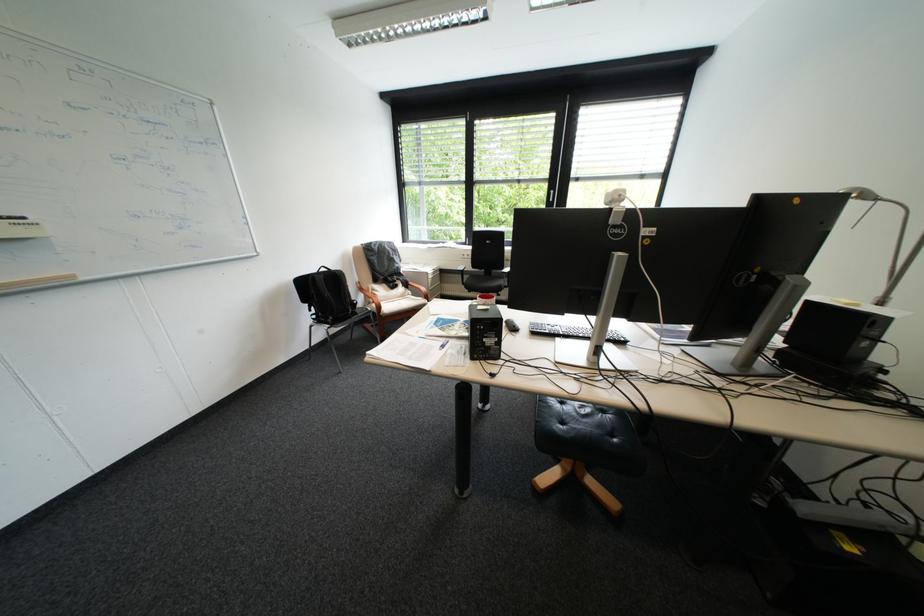
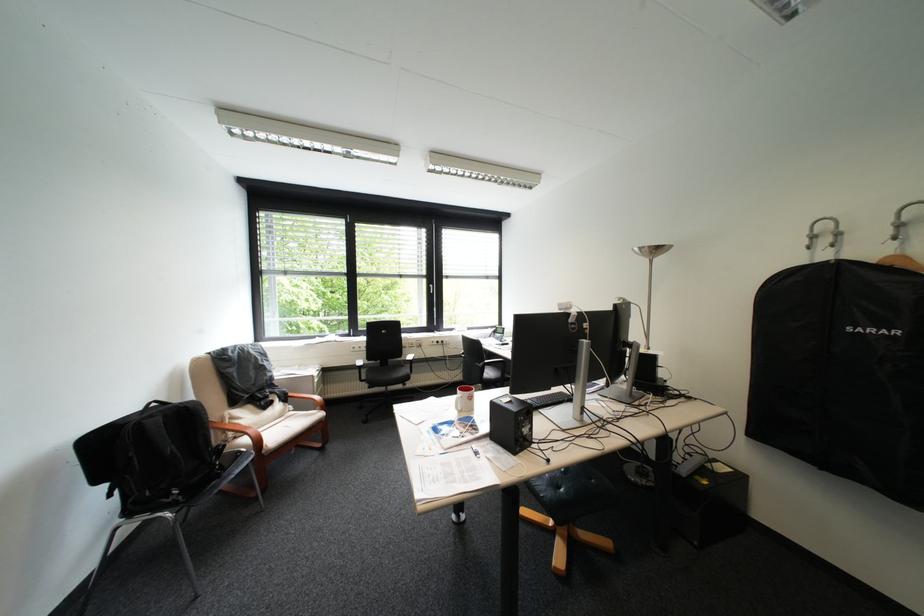
Where in the second image is the point corresponding to the point at 391,308 from the first image?

(271, 443)